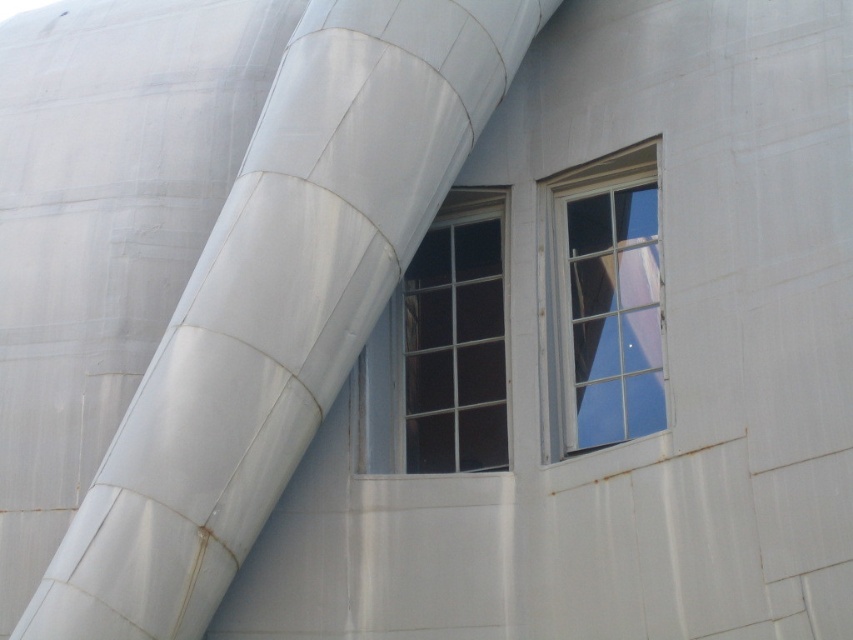
You are an architect inspecting the building facade. You notice two clear glass windows. The first is labeled as clear glass window at center and the second as clear glass window at upper right. From your vantage point, which window is positioned to the left?

The clear glass window at center is positioned to the left of the clear glass window at upper right.

From the picture: You are an architect analyzing the structural integrity of the windows in the image. Given that the clear glass window at center and the clear glass window at upper right are both made of the same material, which window would you prioritize reinforcing if you need to address potential weaknesses related to their size?

The clear glass window at center might be wider than clear glass window at upper right, so the clear glass window at center would require more reinforcement due to its larger size.

You are an architect inspecting the building facade. You notice two clear glass windows in the scene. Which window, the clear glass window at center or the clear glass window at upper right, is positioned further away from you?

The clear glass window at upper right is behind clear glass window at center, so it is positioned further away from you.